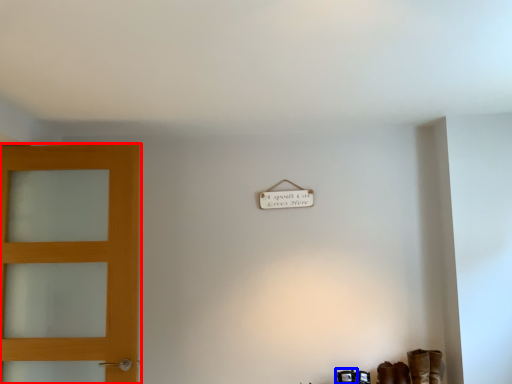
Question: Which of the following is the farthest to the observer, door (highlighted by a red box) or shoe (highlighted by a blue box)?

Choices:
 (A) door
 (B) shoe

Answer: (B)